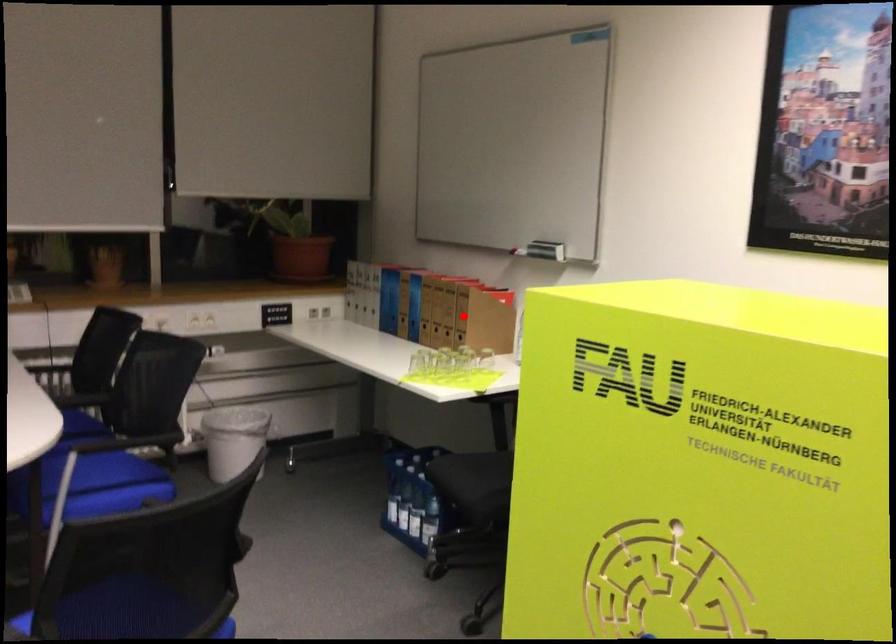
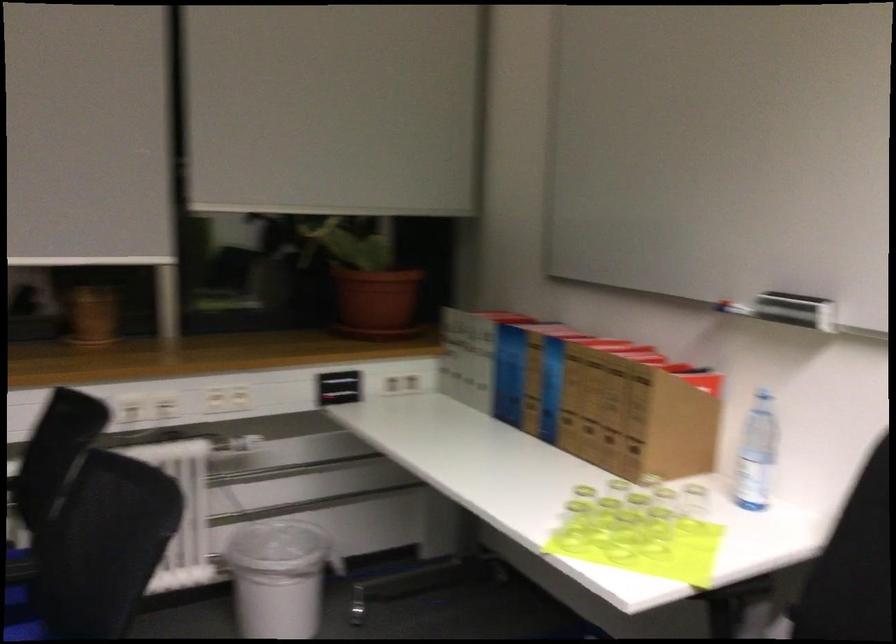
Question: A red point is marked in image1. In image2, is the corresponding 3D point closer to the camera or farther? Reply with the corresponding letter.

Choices:
 (A) The corresponding 3D point is closer.
 (B) The corresponding 3D point is farther.

Answer: (A)